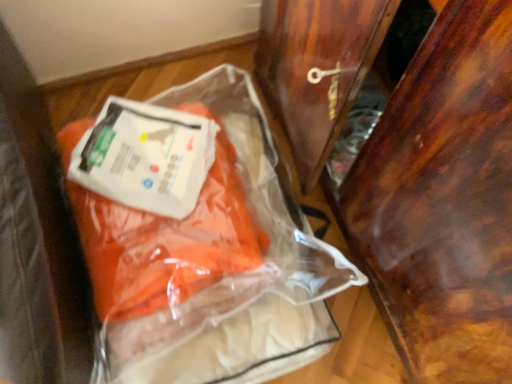
The height and width of the screenshot is (384, 512). Describe the element at coordinates (411, 167) in the screenshot. I see `wooden wardrobe door at right` at that location.

The width and height of the screenshot is (512, 384). I want to click on wooden wardrobe door at right, so click(x=411, y=167).

What do you see at coordinates (193, 236) in the screenshot?
I see `transparent plastic bag at center` at bounding box center [193, 236].

Locate an element on the screen. The width and height of the screenshot is (512, 384). transparent plastic bag at center is located at coordinates (193, 236).

Find the location of a particular element. The height and width of the screenshot is (384, 512). wooden wardrobe door at right is located at coordinates (411, 167).

Which object is positioned more to the left, transparent plastic bag at center or wooden wardrobe door at right?

From the viewer's perspective, transparent plastic bag at center appears more on the left side.

Is the position of transparent plastic bag at center more distant than that of wooden wardrobe door at right?

Yes, transparent plastic bag at center is behind wooden wardrobe door at right.

Is point (338, 265) farther from camera compared to point (435, 79)?

That is True.

From the image's perspective, which is above, transparent plastic bag at center or wooden wardrobe door at right?

wooden wardrobe door at right is shown above in the image.

From a real-world perspective, does transparent plastic bag at center sit lower than wooden wardrobe door at right?

Correct, in the physical world, transparent plastic bag at center is lower than wooden wardrobe door at right.

Looking at this image, between transparent plastic bag at center and wooden wardrobe door at right, which one has larger width?

wooden wardrobe door at right.

Who is shorter, transparent plastic bag at center or wooden wardrobe door at right?

transparent plastic bag at center.

Who is smaller, transparent plastic bag at center or wooden wardrobe door at right?

transparent plastic bag at center.

Is wooden wardrobe door at right located within transparent plastic bag at center?

No, wooden wardrobe door at right is not a part of transparent plastic bag at center.

Are transparent plastic bag at center and wooden wardrobe door at right located far from each other?

They are positioned close to each other.

Does transparent plastic bag at center turn towards wooden wardrobe door at right?

No, transparent plastic bag at center is not facing towards wooden wardrobe door at right.

This screenshot has width=512, height=384. I want to click on furniture lying on the right of transparent plastic bag at center, so click(x=411, y=167).

Is wooden wardrobe door at right at the left side of transparent plastic bag at center?

Incorrect, wooden wardrobe door at right is not on the left side of transparent plastic bag at center.

Which is behind, wooden wardrobe door at right or transparent plastic bag at center?

transparent plastic bag at center.

Is point (386, 204) in front of point (185, 275)?

Yes, point (386, 204) is closer to viewer.

From the image's perspective, is wooden wardrobe door at right located beneath transparent plastic bag at center?

Incorrect, from the image's perspective, wooden wardrobe door at right is higher than transparent plastic bag at center.

From a real-world perspective, is wooden wardrobe door at right physically above transparent plastic bag at center?

Yes.

Considering the sizes of objects wooden wardrobe door at right and transparent plastic bag at center in the image provided, who is wider, wooden wardrobe door at right or transparent plastic bag at center?

Wider between the two is wooden wardrobe door at right.

Between wooden wardrobe door at right and transparent plastic bag at center, which one has less height?

transparent plastic bag at center is shorter.

Looking at the image, does wooden wardrobe door at right seem bigger or smaller compared to transparent plastic bag at center?

Answer: In the image, wooden wardrobe door at right appears to be larger than transparent plastic bag at center.

Is wooden wardrobe door at right completely or partially outside of transparent plastic bag at center?

Yes, wooden wardrobe door at right is not within transparent plastic bag at center.

Would you say wooden wardrobe door at right is a long distance from transparent plastic bag at center?

No, there isn't a large distance between wooden wardrobe door at right and transparent plastic bag at center.

Is wooden wardrobe door at right facing towards transparent plastic bag at center?

Yes, wooden wardrobe door at right faces towards transparent plastic bag at center.

How many degrees apart are the facing directions of wooden wardrobe door at right and transparent plastic bag at center?

The facing directions of wooden wardrobe door at right and transparent plastic bag at center are 91.6 degrees apart.

Find the location of a particular element. The image size is (512, 384). furniture above the transparent plastic bag at center (from the image's perspective) is located at coordinates (411, 167).

Identify the location of furniture located in front of the transparent plastic bag at center. Image resolution: width=512 pixels, height=384 pixels. (411, 167).

Locate an element on the screen. furniture located above the transparent plastic bag at center (from a real-world perspective) is located at coordinates (411, 167).